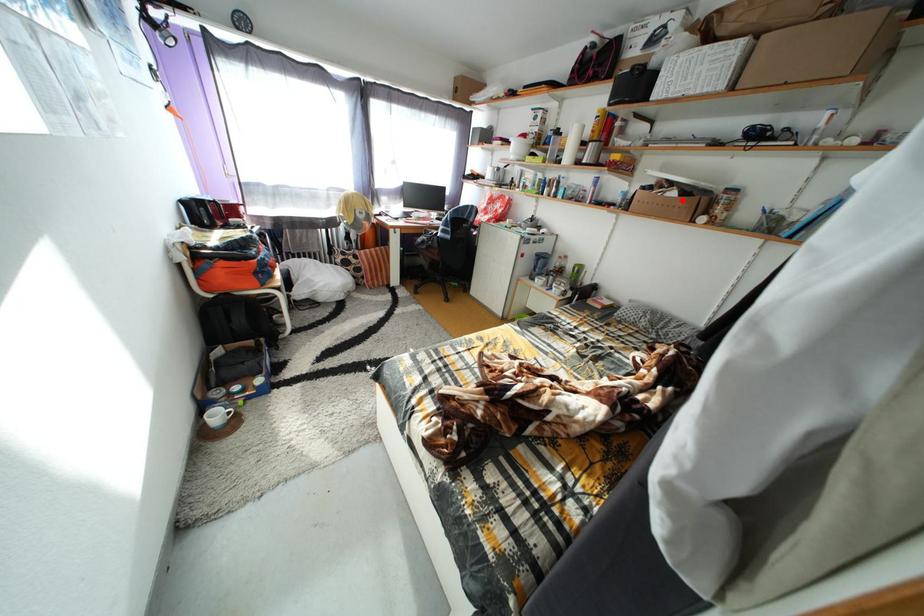
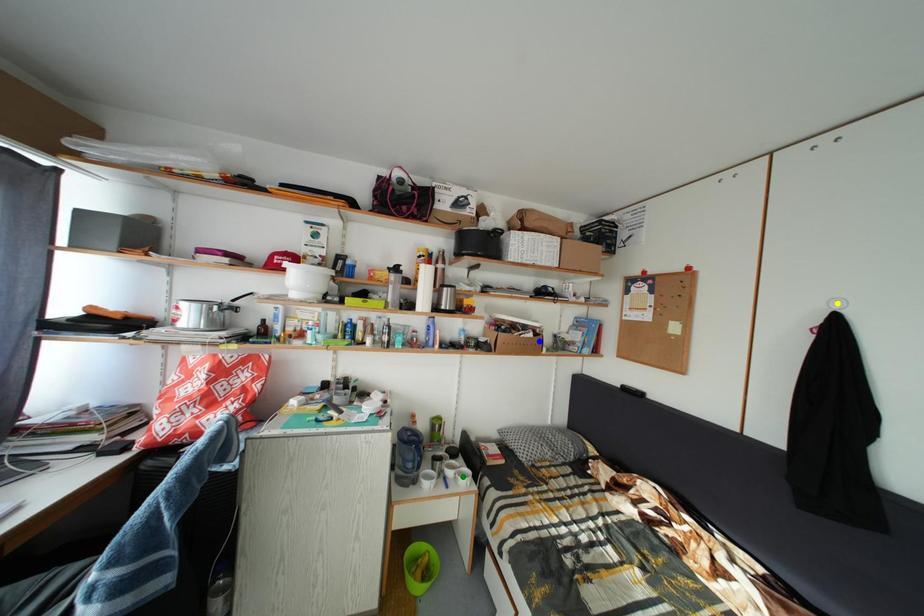
Question: I am providing you with two images of the same scene from different viewpoints. A red point is marked on the first image. You are given multiple points on the second image. Which point in image 2 is actually the same real-world point as the red point in image 1?

Choices:
 (A) yellow point
 (B) green point
 (C) blue point

Answer: (C)